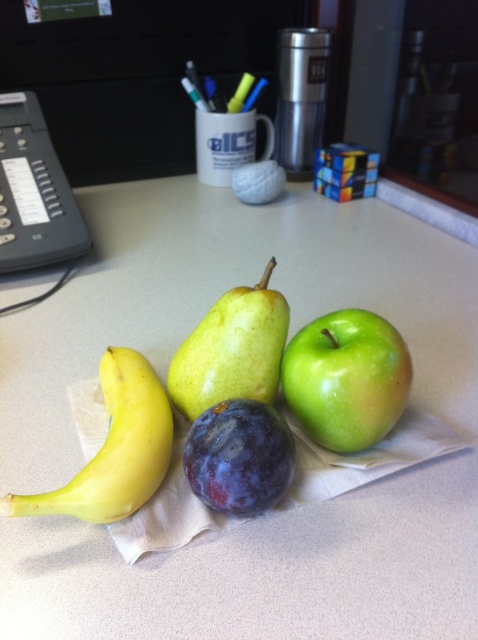
Question: Which is farther from the yellow smooth banana at left?

Choices:
 (A) green matte pear at center
 (B) green matte apple at center
 (C) white paper towel at center

Answer: (C)

Question: Is white paper towel at center to the right of black plastic phone at upper left from the viewer's perspective?

Choices:
 (A) no
 (B) yes

Answer: (B)

Question: Does green matte apple at center appear on the right side of purple matte plum at center?

Choices:
 (A) no
 (B) yes

Answer: (B)

Question: Considering the real-world distances, which object is farthest from the purple matte plum at center?

Choices:
 (A) white paper towel at center
 (B) yellow smooth banana at left

Answer: (A)

Question: Is green matte apple at center further to camera compared to green matte pear at center?

Choices:
 (A) no
 (B) yes

Answer: (A)

Question: Among these points, which one is farthest from the camera?

Choices:
 (A) (12, 225)
 (B) (333, 426)

Answer: (A)